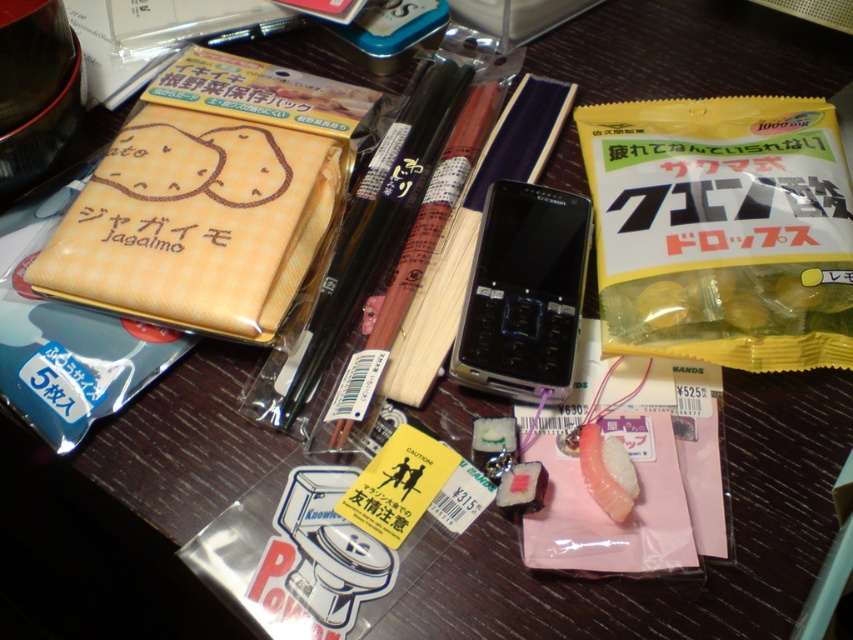
Question: Does yellow fabric pouch at upper left have a larger size compared to yellow gelatinous candies at center right?

Choices:
 (A) no
 (B) yes

Answer: (B)

Question: Among these objects, which one is nearest to the camera?

Choices:
 (A) yellow gelatinous candies at center right
 (B) white glossy fish at center
 (C) black plastic phone at center
 (D) pink glossy sushi at center

Answer: (B)

Question: Which of the following is the closest to the observer?

Choices:
 (A) black plastic phone at center
 (B) pink glossy sushi at center
 (C) yellow/golden plastic bag at upper right

Answer: (B)

Question: Among these objects, which one is nearest to the camera?

Choices:
 (A) black plastic phone at center
 (B) white glossy fish at center
 (C) yellow gelatinous candies at center right

Answer: (B)

Question: Considering the relative positions of yellow gelatinous candies at center right and pink glossy sushi at center in the image provided, where is yellow gelatinous candies at center right located with respect to pink glossy sushi at center?

Choices:
 (A) right
 (B) left

Answer: (A)

Question: Can you confirm if yellow fabric pouch at upper left is wider than black plastic pen at center?

Choices:
 (A) no
 (B) yes

Answer: (B)